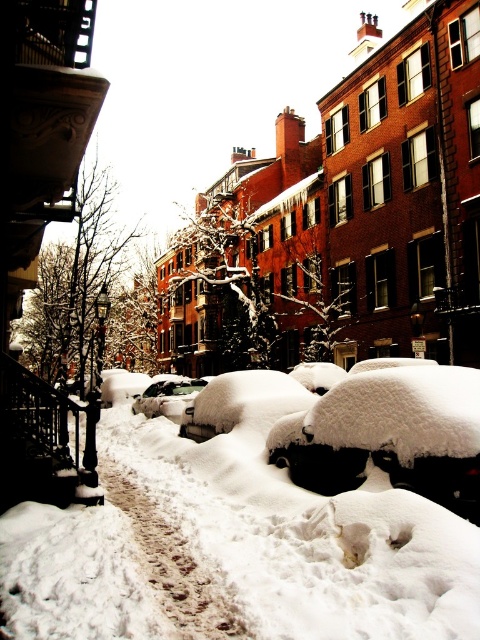
Question: Is white fluffy snow at center below shiny silver car at center?

Choices:
 (A) no
 (B) yes

Answer: (A)

Question: Does white fluffy snow at center have a lesser width compared to shiny silver car at center?

Choices:
 (A) no
 (B) yes

Answer: (A)

Question: Is white fluffy snow at center smaller than shiny silver car at center?

Choices:
 (A) no
 (B) yes

Answer: (A)